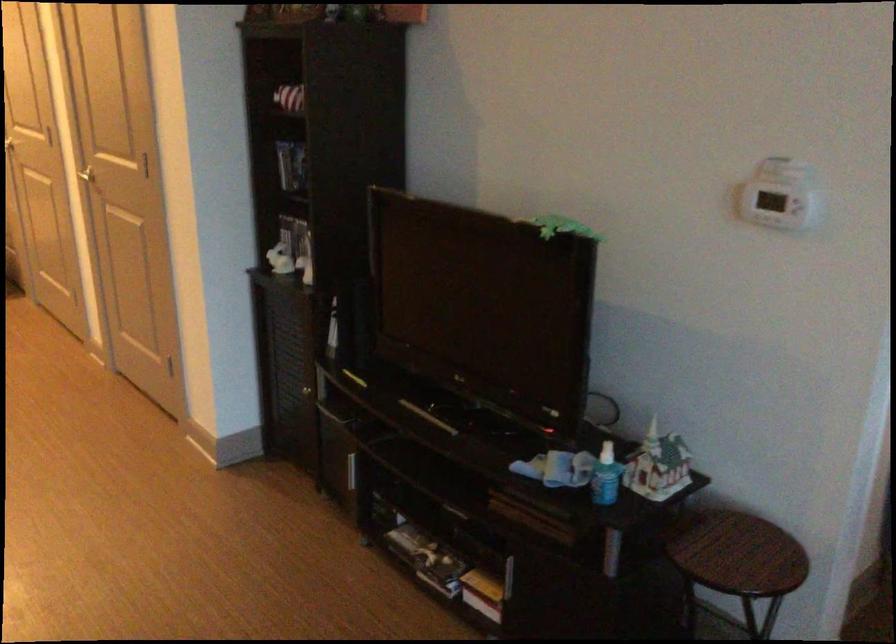
Where is `green lizard toy`? The image size is (896, 644). green lizard toy is located at coordinates (563, 227).